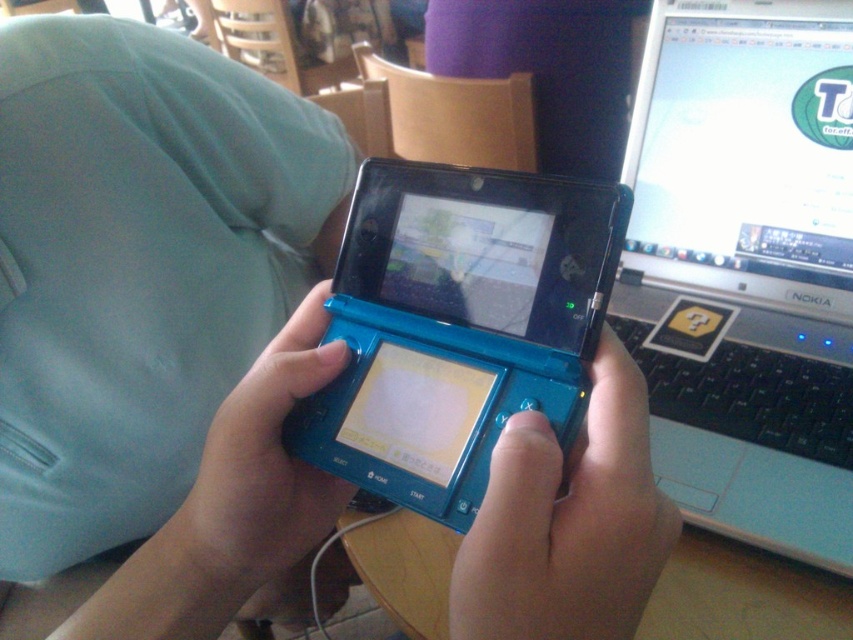
Between silver/black plastic laptop at right and teal plastic game console at center, which one appears on the left side from the viewer's perspective?

Positioned to the left is teal plastic game console at center.

Does silver/black plastic laptop at right have a smaller size compared to teal plastic game console at center?

No, silver/black plastic laptop at right is not smaller than teal plastic game console at center.

You are a GUI agent. You are given a task and a screenshot of the screen. Output one action in this format:
    pyautogui.click(x=<x>, y=<y>)
    Task: Click on the silver/black plastic laptop at right
    The height and width of the screenshot is (640, 853).
    Given the screenshot: What is the action you would take?
    pyautogui.click(x=746, y=266)

Locate an element on the screen. This screenshot has height=640, width=853. silver/black plastic laptop at right is located at coordinates (746, 266).

Does point (436, 275) come behind point (263, 515)?

Yes.

Which of these two, teal plastic handheld gaming console at center or blue rubberized controller at center, stands shorter?

teal plastic handheld gaming console at center is shorter.

The width and height of the screenshot is (853, 640). I want to click on teal plastic handheld gaming console at center, so click(x=485, y=250).

This screenshot has width=853, height=640. What are the coordinates of `teal plastic handheld gaming console at center` in the screenshot? It's located at (485, 250).

Can you confirm if matte plastic laptop at upper right is positioned to the right of teal plastic game controller at center?

Correct, you'll find matte plastic laptop at upper right to the right of teal plastic game controller at center.

Who is lower down, matte plastic laptop at upper right or teal plastic game controller at center?

teal plastic game controller at center is below.

Is point (662, 168) farther from camera compared to point (526, 529)?

Yes, it is.

I want to click on matte plastic laptop at upper right, so click(746, 138).